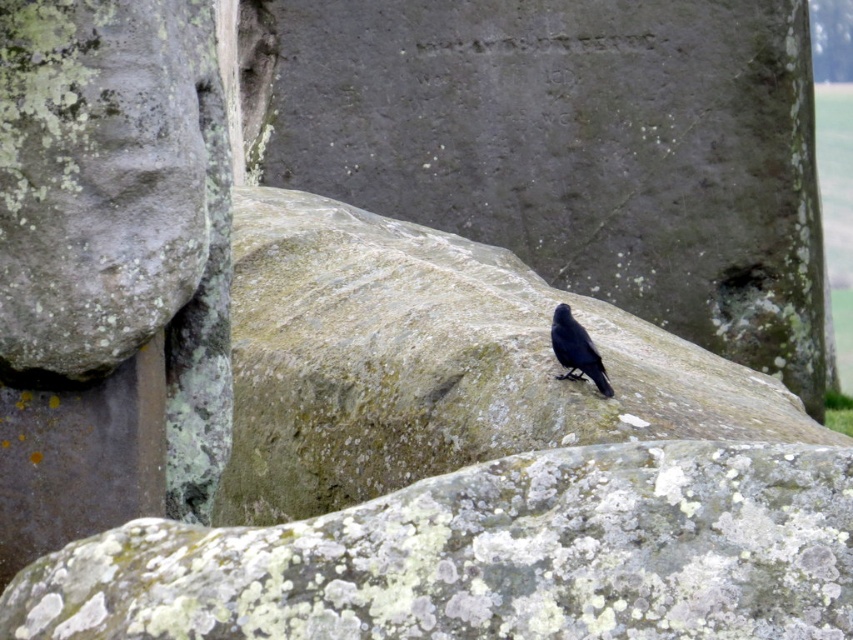
Question: Which object appears farthest from the camera in this image?

Choices:
 (A) shiny black crow at center
 (B) smooth gray rock at center

Answer: (A)

Question: From the image, what is the correct spatial relationship of speckled gray rock at center in relation to smooth gray rock at center?

Choices:
 (A) above
 (B) below

Answer: (B)

Question: Can you confirm if speckled gray rock at center is smaller than shiny black crow at center?

Choices:
 (A) yes
 (B) no

Answer: (B)

Question: Does smooth gray rock at center have a smaller size compared to shiny black crow at center?

Choices:
 (A) yes
 (B) no

Answer: (B)

Question: Among these points, which one is nearest to the camera?

Choices:
 (A) (247, 337)
 (B) (148, 532)
 (C) (560, 333)

Answer: (B)

Question: Among these objects, which one is nearest to the camera?

Choices:
 (A) speckled gray rock at center
 (B) smooth gray rock at center

Answer: (A)